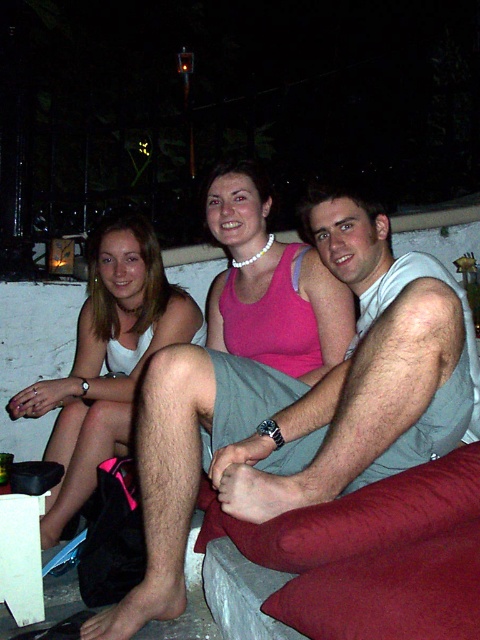
Question: Observing the image, what is the correct spatial positioning of gray fabric shorts at center in reference to white matte tank top at left?

Choices:
 (A) left
 (B) right

Answer: (B)

Question: Which point is closer to the camera?

Choices:
 (A) gray fabric shorts at center
 (B) white matte tank top at left

Answer: (A)

Question: Is gray fabric shorts at center to the right of white matte tank top at left from the viewer's perspective?

Choices:
 (A) no
 (B) yes

Answer: (B)

Question: Does gray fabric shorts at center appear over white matte tank top at left?

Choices:
 (A) yes
 (B) no

Answer: (B)